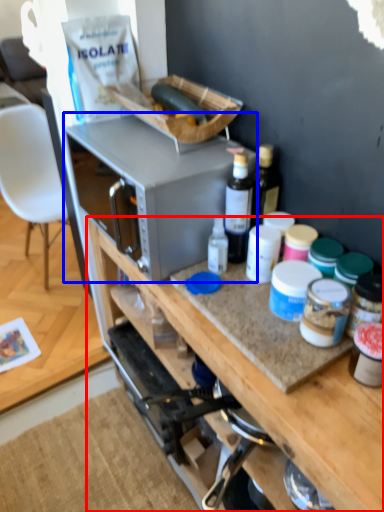
Question: Which of the following is the farthest to the observer, cabinetry (highlighted by a red box) or microwave oven (highlighted by a blue box)?

Choices:
 (A) cabinetry
 (B) microwave oven

Answer: (B)